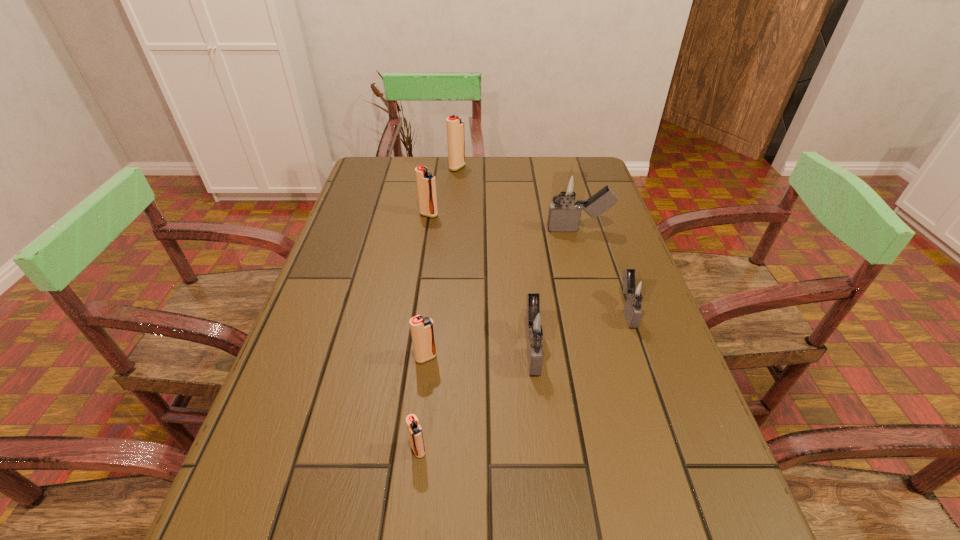
Image resolution: width=960 pixels, height=540 pixels. I want to click on vacant space that satisfies the following two spatial constraints: 1. on the back side of the farthest igniter; 2. on the right side of the second smallest red igniter, so click(x=447, y=167).

Locate an element on the screen. The image size is (960, 540). blank area in the image that satisfies the following two spatial constraints: 1. on the front side of the fifth nearest object; 2. on the right side of the smallest gray igniter is located at coordinates (601, 310).